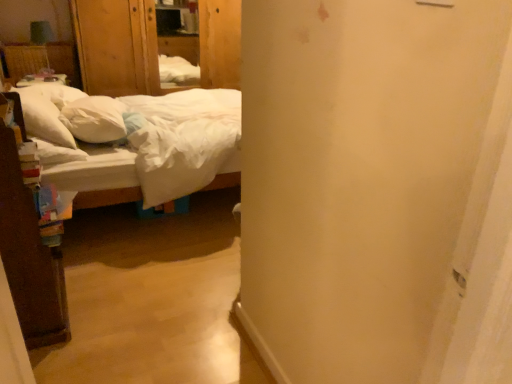
Question: Is white cotton bed at left oriented away from wooden armoire at upper left?

Choices:
 (A) no
 (B) yes

Answer: (A)

Question: Is wooden armoire at upper left completely or partially inside white cotton bed at left?

Choices:
 (A) no
 (B) yes

Answer: (A)

Question: From a real-world perspective, is white cotton bed at left positioned under wooden armoire at upper left based on gravity?

Choices:
 (A) yes
 (B) no

Answer: (A)

Question: Is white cotton bed at left positioned beyond the bounds of wooden armoire at upper left?

Choices:
 (A) yes
 (B) no

Answer: (A)

Question: Can you confirm if white cotton bed at left is smaller than wooden armoire at upper left?

Choices:
 (A) no
 (B) yes

Answer: (A)

Question: Is white soft pillow at left, the 2th pillow in the left-to-right sequence, spatially inside white cotton bed at left, or outside of it?

Choices:
 (A) inside
 (B) outside

Answer: (A)

Question: Is white soft pillow at left, the 2th pillow in the left-to-right sequence, in front of or behind white cotton bed at left in the image?

Choices:
 (A) behind
 (B) front

Answer: (A)

Question: Visually, is white soft pillow at left, the 2th pillow in the left-to-right sequence, positioned to the left or to the right of white cotton bed at left?

Choices:
 (A) left
 (B) right

Answer: (A)

Question: From the image's perspective, relative to white cotton bed at left, is white soft pillow at left, which appears as the 1th pillow when viewed from the right, above or below?

Choices:
 (A) above
 (B) below

Answer: (A)

Question: In the image, is white soft pillow at left, the 2th pillow in the left-to-right sequence, on the left side or the right side of wooden armoire at upper left?

Choices:
 (A) left
 (B) right

Answer: (A)

Question: In terms of size, does white soft pillow at left, the 2th pillow in the left-to-right sequence, appear bigger or smaller than wooden armoire at upper left?

Choices:
 (A) small
 (B) big

Answer: (A)

Question: From the image's perspective, is white soft pillow at left, the 2th pillow in the left-to-right sequence, located above or below wooden armoire at upper left?

Choices:
 (A) below
 (B) above

Answer: (A)

Question: From a real-world perspective, relative to wooden armoire at upper left, is white soft pillow at left, which appears as the 1th pillow when viewed from the right, vertically above or below?

Choices:
 (A) above
 (B) below

Answer: (B)

Question: Considering the positions of white soft pillow at left, the 1th pillow when ordered from left to right, and white cotton bed at left in the image, is white soft pillow at left, the 1th pillow when ordered from left to right, taller or shorter than white cotton bed at left?

Choices:
 (A) short
 (B) tall

Answer: (A)

Question: From a real-world perspective, is white soft pillow at left, the 1th pillow when ordered from left to right, above or below white cotton bed at left?

Choices:
 (A) below
 (B) above

Answer: (B)